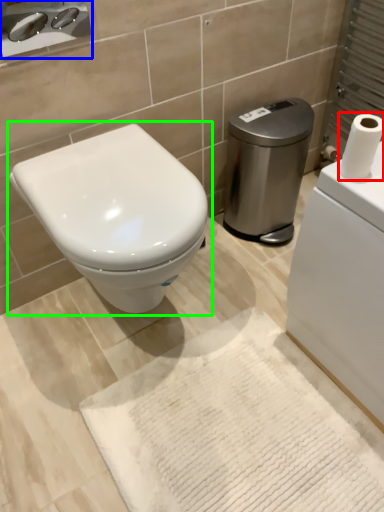
Question: Considering the real-world distances, which object is closest to toilet paper (highlighted by a red box)? sink (highlighted by a blue box) or toilet (highlighted by a green box).

Choices:
 (A) sink
 (B) toilet

Answer: (B)